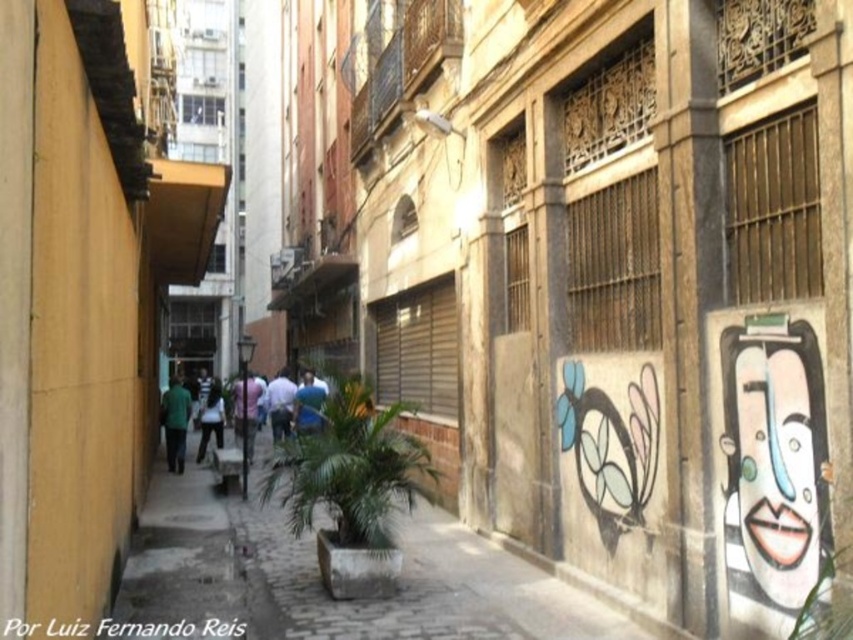
Question: Which object appears farthest from the camera in this image?

Choices:
 (A) blue shirt at center
 (B) light blue shirt at center
 (C) brown concrete pavement at center
 (D) white glossy face at right

Answer: (A)

Question: Is green matte shirt at center positioned at the back of blue fabric shirt at center?

Choices:
 (A) yes
 (B) no

Answer: (A)

Question: Which is nearer to the blue shirt at center?

Choices:
 (A) green matte shirt at center
 (B) white glossy face at right
 (C) light blue shirt at center
 (D) brown concrete pavement at center

Answer: (C)

Question: Which object appears closest to the camera in this image?

Choices:
 (A) blue shirt at center
 (B) blue fabric shirt at center

Answer: (B)

Question: Does blue fabric shirt at center appear over light blue shirt at center?

Choices:
 (A) yes
 (B) no

Answer: (A)

Question: Can you confirm if green matte shirt at center is positioned to the left of light blue shirt at center?

Choices:
 (A) no
 (B) yes

Answer: (B)